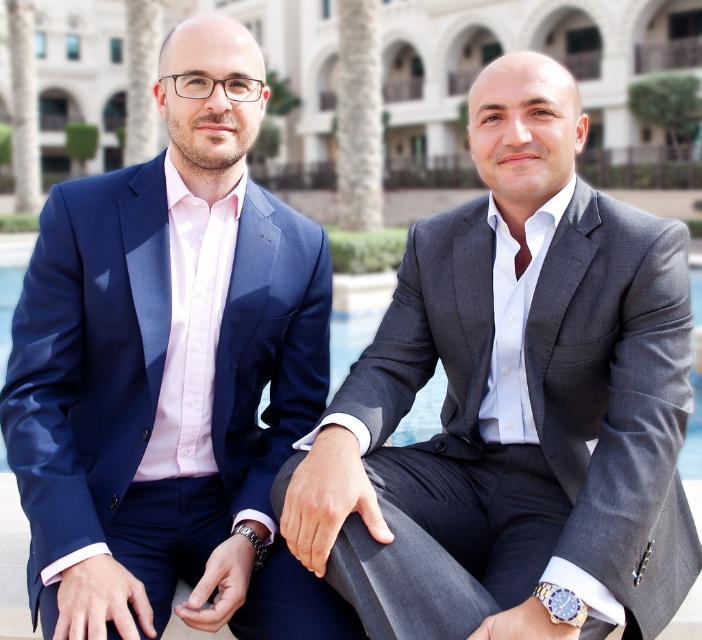
You are a photographer setting up a shot of the two men in the scene. You need to focus on the gray textured suit at center. Where should you position your camera relative to the point marked at coordinates (512, 403)?

The point at coordinates (512, 403) marks the exact location of the gray textured suit at center, so you should position your camera directly facing this point to focus on it.

You are a photographer setting up for a portrait in this scene. You want to focus on the person wearing the gray textured suit at center while ensuring the matte blue suit at left is still visible in the background. Can you position yourself so that both are in frame without moving either subject?

Yes, since the gray textured suit at center is closer to the viewer than the matte blue suit at left, you can position yourself between them to include both in the frame with the gray textured suit at center in the foreground and the matte blue suit at left further back in the background.

You are a photographer setting up a shoot in this scene. You need to position a light source to the right of the matte blue suit at left and to the left of the gray textured suit at center. Is this possible based on their positions?

Yes, since the gray textured suit at center is to the right of the matte blue suit at left, placing the light source between them would satisfy both conditions.